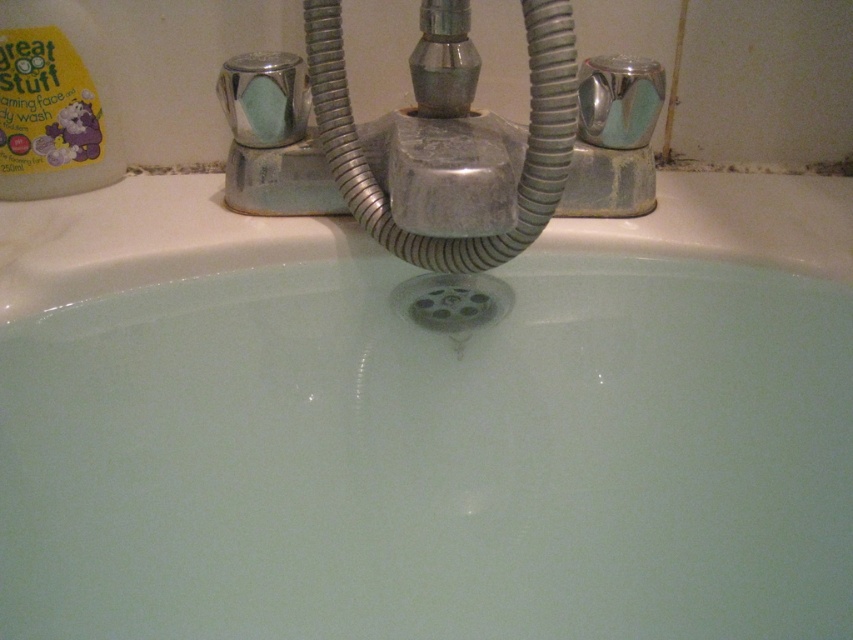
From the picture: You are trying to place a new decorative item on your bathroom sink. You have a small statue that is the same size as the matte green soap at upper center. Can the white glossy bath at center fit the statue without moving the existing items?

The white glossy bath at center is bigger than the matte green soap at upper center. Since the statue is the same size as the matte green soap at upper center, the statue can fit on the white glossy bath at center without moving existing items.